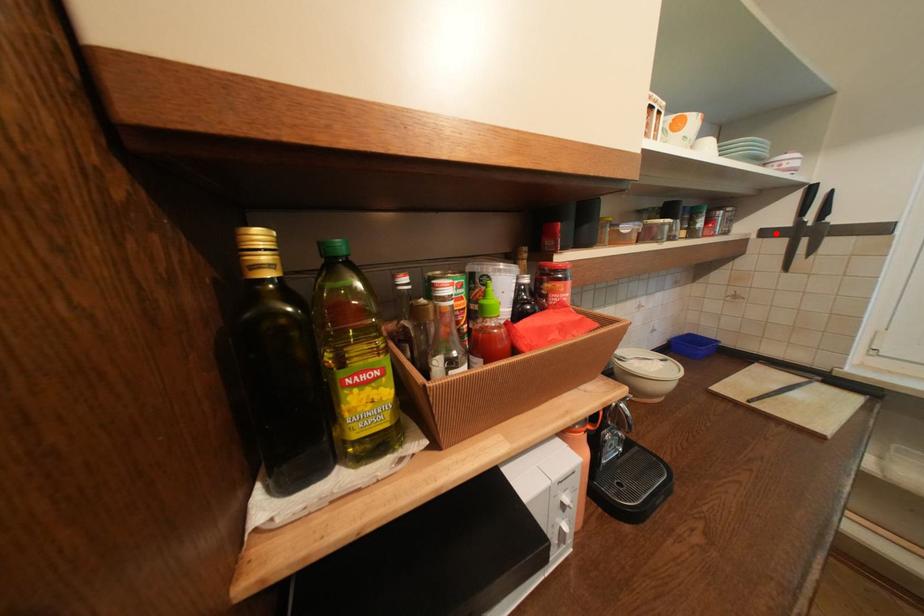
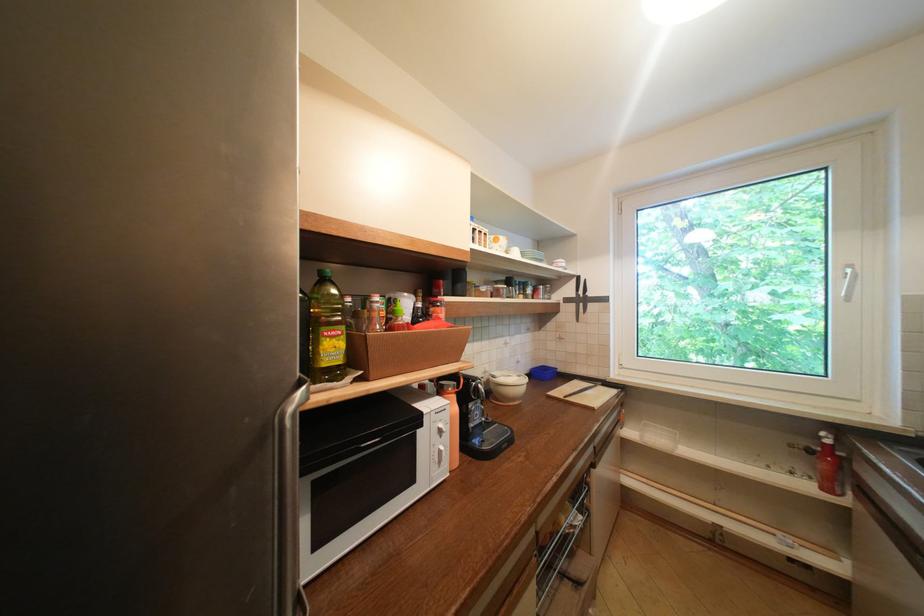
Question: I am providing you with two images of the same scene from different viewpoints. A red point is marked on the first image. Can you still see the location of the red point in image 2?

Choices:
 (A) Yes
 (B) No

Answer: (A)